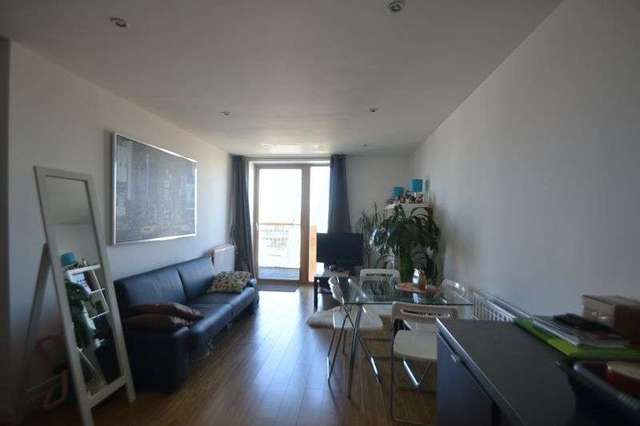
Image resolution: width=640 pixels, height=426 pixels. I want to click on plant, so click(406, 242).